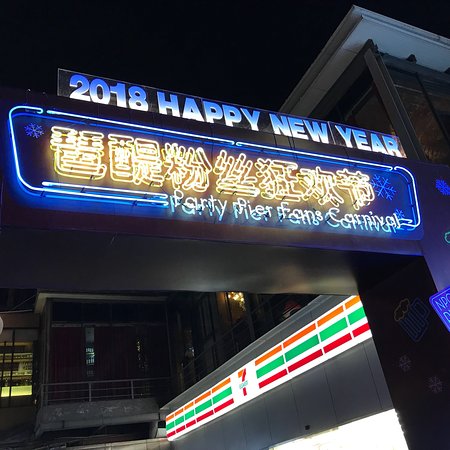
Identify the location of corner. (404, 62).